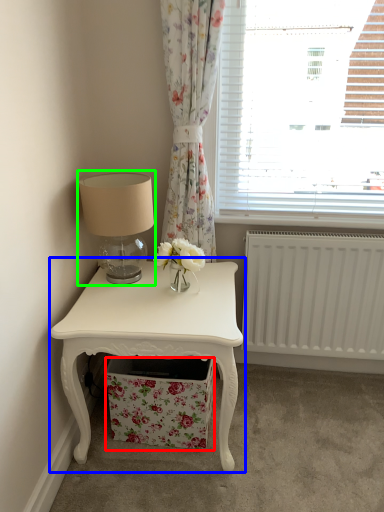
Question: Which is farther away from drawer (highlighted by a red box)? nightstand (highlighted by a blue box) or table lamp (highlighted by a green box)?

Choices:
 (A) nightstand
 (B) table lamp

Answer: (B)